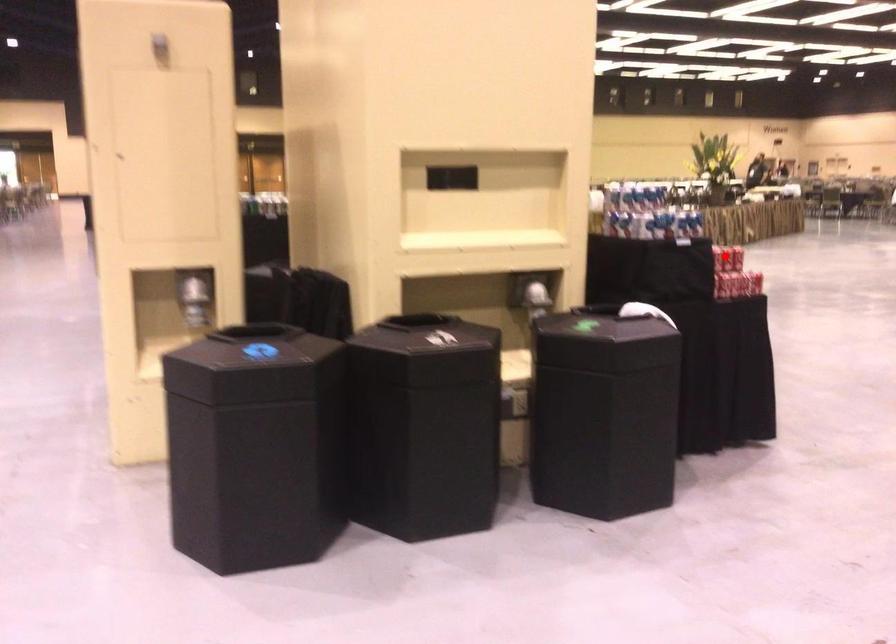
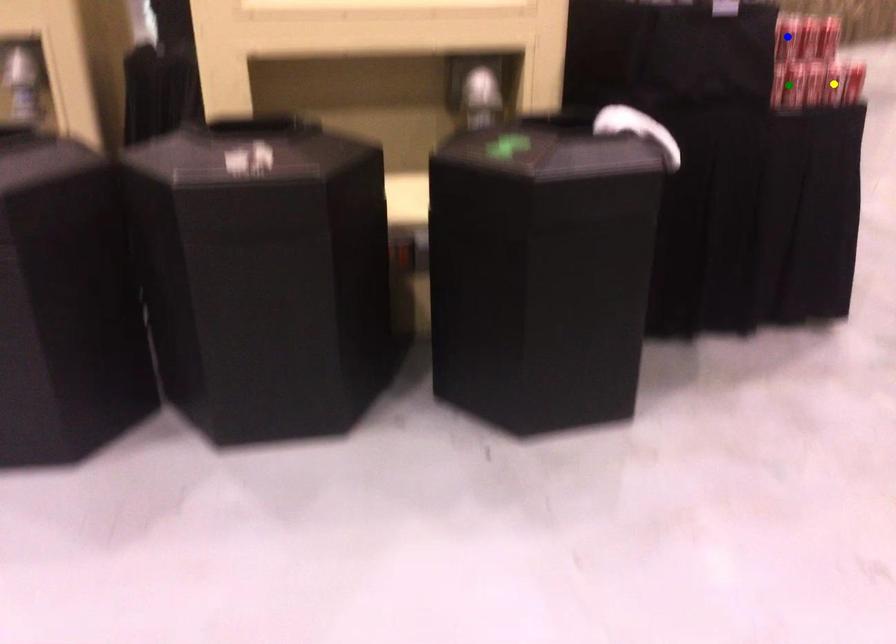
Question: I am providing you with two images of the same scene from different viewpoints. A red point is marked on the first image. You are given multiple points on the second image. In image 2, which mark is for the same physical point as the one in image 1?

Choices:
 (A) green point
 (B) blue point
 (C) yellow point

Answer: (B)